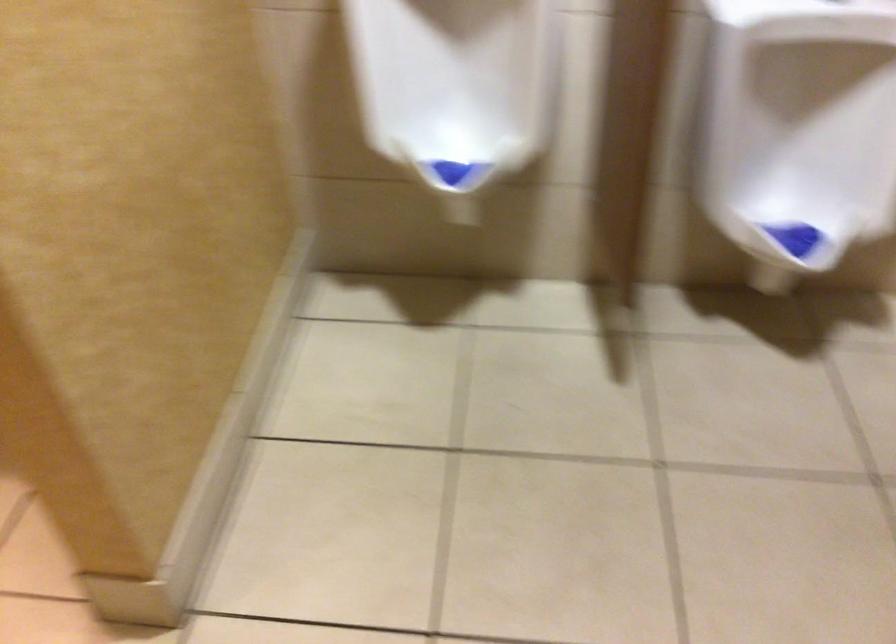
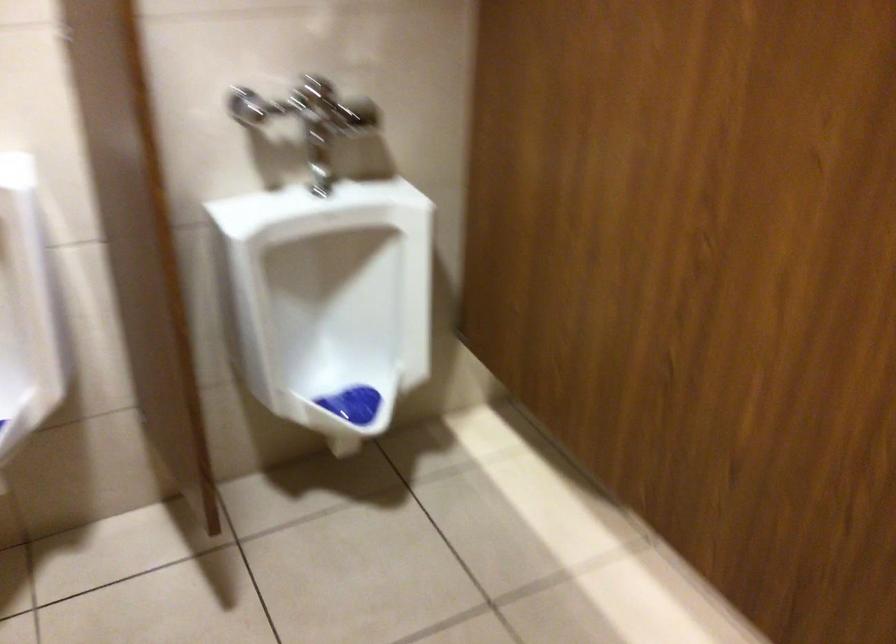
Question: The camera is either moving clockwise (left) or counter-clockwise (right) around the object. The first image is from the beginning of the video and the second image is from the end. Is the camera moving left or right when shooting the video?

Choices:
 (A) Left
 (B) Right

Answer: (A)